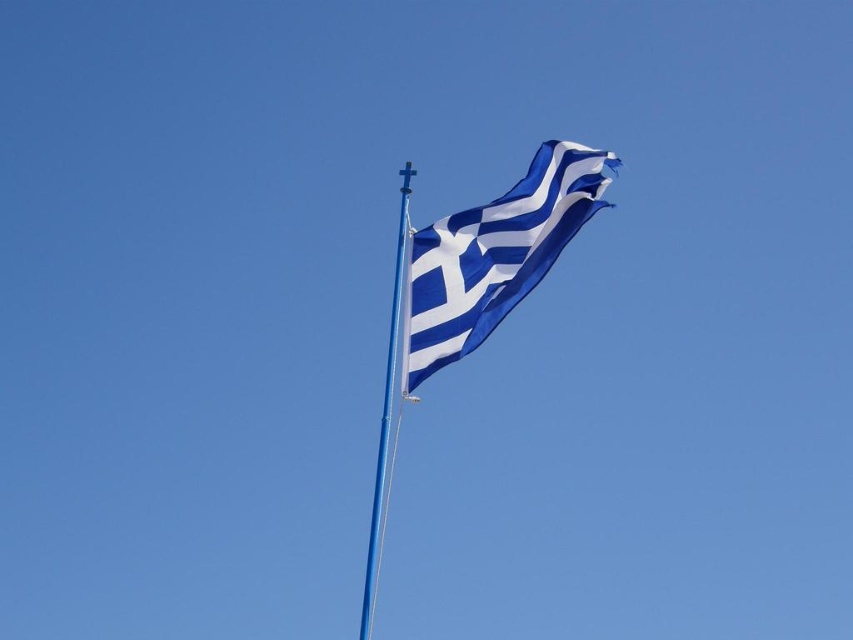
Does blue/white striped flag at center appear under smooth metal pole at center?

Incorrect, blue/white striped flag at center is not positioned below smooth metal pole at center.

Can you confirm if blue/white striped flag at center is shorter than smooth metal pole at center?

Yes, blue/white striped flag at center is shorter than smooth metal pole at center.

This screenshot has width=853, height=640. Describe the element at coordinates (495, 253) in the screenshot. I see `blue/white striped flag at center` at that location.

Locate an element on the screen. blue/white striped flag at center is located at coordinates (495, 253).